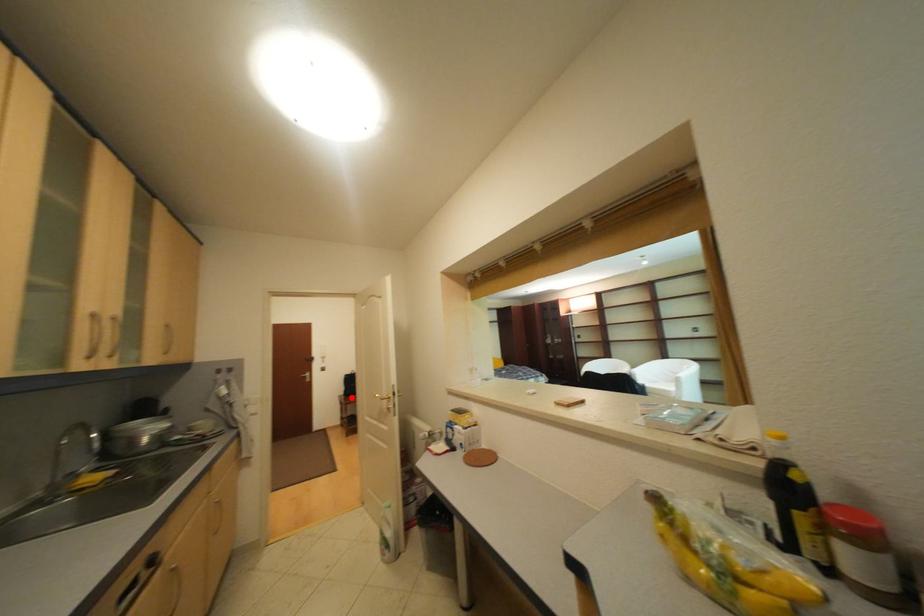
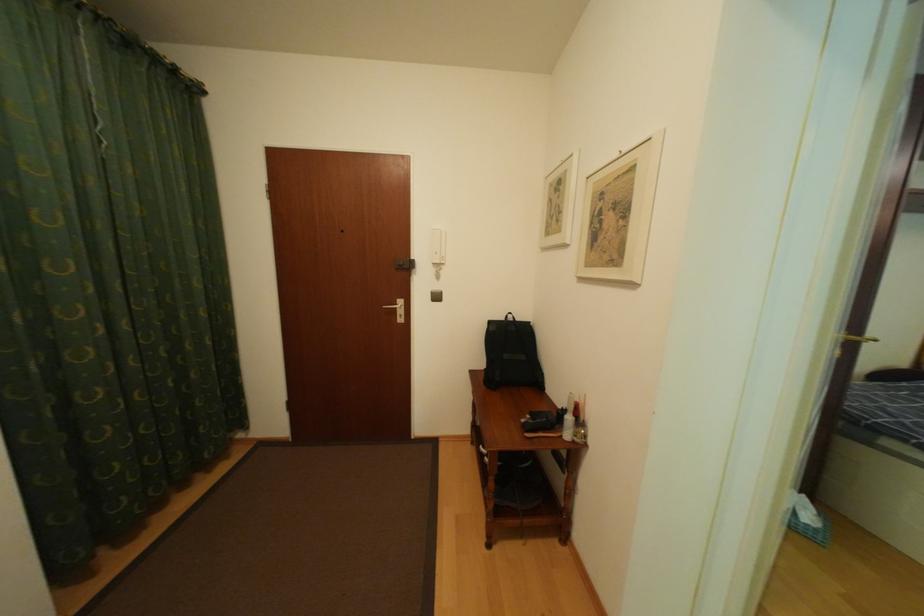
In the second image, find the point that corresponds to the highlighted location in the first image.

(484, 374)